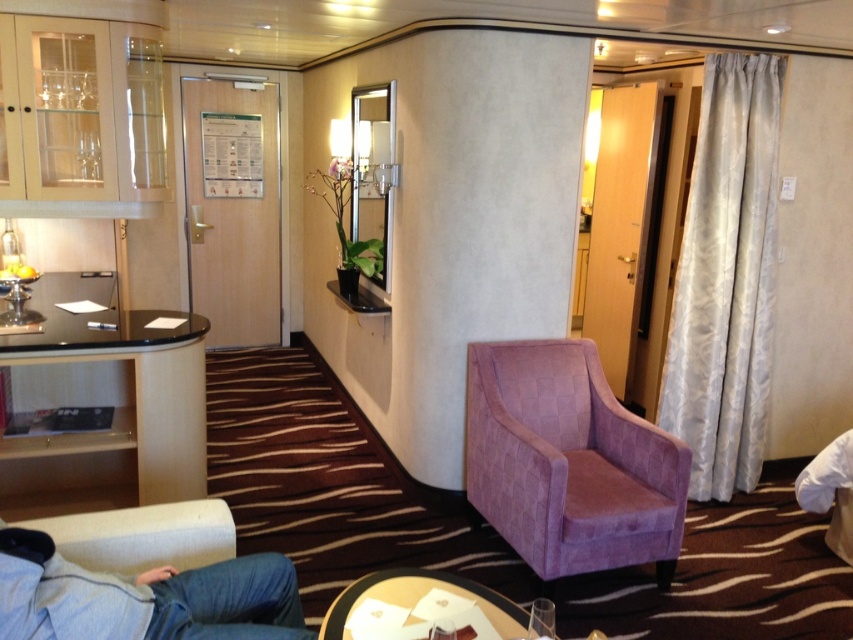
Question: Based on their relative distances, which object is farther from the wooden round table at center?

Choices:
 (A) white textured curtain at right
 (B) black glass table at left

Answer: (A)

Question: Which of the following is the closest to the observer?

Choices:
 (A) black glass table at left
 (B) white textured curtain at right

Answer: (A)

Question: In this image, where is faded denim jacket at lower left located relative to wooden round table at center?

Choices:
 (A) right
 (B) left

Answer: (B)

Question: Is black glass table at left positioned before faded denim jacket at lower left?

Choices:
 (A) yes
 (B) no

Answer: (B)

Question: Where is white textured curtain at right located in relation to wooden round table at center in the image?

Choices:
 (A) below
 (B) above

Answer: (B)

Question: Estimate the real-world distances between objects in this image. Which object is closer to the wooden round table at center?

Choices:
 (A) black glass table at left
 (B) white textured curtain at right

Answer: (A)